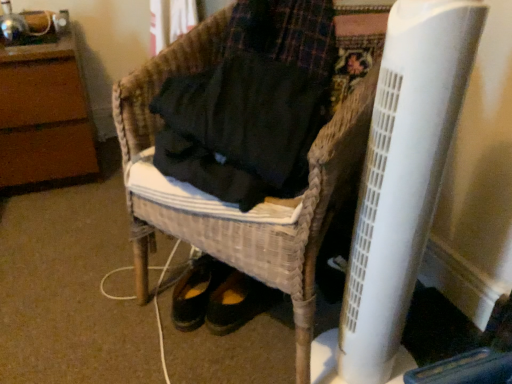
I want to click on free region on the left part of white plastic radiator at lower right, so click(260, 352).